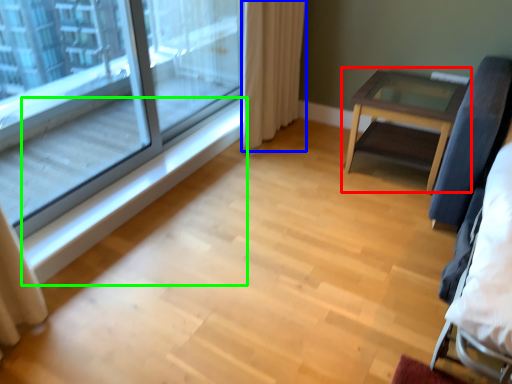
Question: Considering the real-world distances, which object is farthest from table (highlighted by a red box)? curtain (highlighted by a blue box) or window sill (highlighted by a green box)?

Choices:
 (A) curtain
 (B) window sill

Answer: (B)